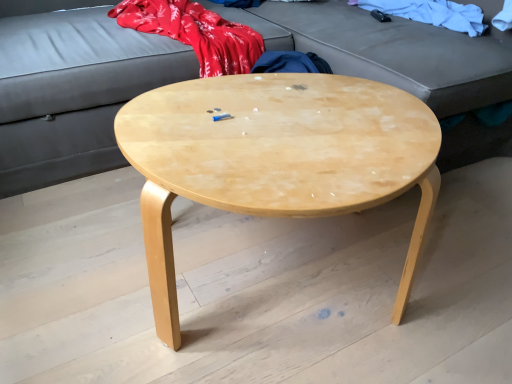
Question: Is matte gray studio couch at upper center wider than natural wood coffee table at center?

Choices:
 (A) yes
 (B) no

Answer: (A)

Question: Is matte gray studio couch at upper center far from natural wood coffee table at center?

Choices:
 (A) no
 (B) yes

Answer: (A)

Question: From the image's perspective, is matte gray studio couch at upper center on top of natural wood coffee table at center?

Choices:
 (A) no
 (B) yes

Answer: (B)

Question: Can we say matte gray studio couch at upper center lies outside natural wood coffee table at center?

Choices:
 (A) no
 (B) yes

Answer: (B)

Question: Is matte gray studio couch at upper center behind natural wood coffee table at center?

Choices:
 (A) no
 (B) yes

Answer: (B)

Question: Considering the relative sizes of matte gray studio couch at upper center and natural wood coffee table at center in the image provided, is matte gray studio couch at upper center taller than natural wood coffee table at center?

Choices:
 (A) no
 (B) yes

Answer: (B)

Question: Does white cotton cloth at upper right have a larger size compared to matte gray studio couch at upper center?

Choices:
 (A) no
 (B) yes

Answer: (A)

Question: Is white cotton cloth at upper right closer to camera compared to matte gray studio couch at upper center?

Choices:
 (A) no
 (B) yes

Answer: (A)

Question: From a real-world perspective, is white cotton cloth at upper right below matte gray studio couch at upper center?

Choices:
 (A) yes
 (B) no

Answer: (B)

Question: Is white cotton cloth at upper right looking in the opposite direction of matte gray studio couch at upper center?

Choices:
 (A) yes
 (B) no

Answer: (A)

Question: Is white cotton cloth at upper right aimed at matte gray studio couch at upper center?

Choices:
 (A) yes
 (B) no

Answer: (A)

Question: Considering the relative positions of white cotton cloth at upper right and matte gray studio couch at upper center in the image provided, is white cotton cloth at upper right behind matte gray studio couch at upper center?

Choices:
 (A) yes
 (B) no

Answer: (A)

Question: Can you confirm if white cotton cloth at upper right is positioned to the right of natural wood coffee table at center?

Choices:
 (A) no
 (B) yes

Answer: (B)